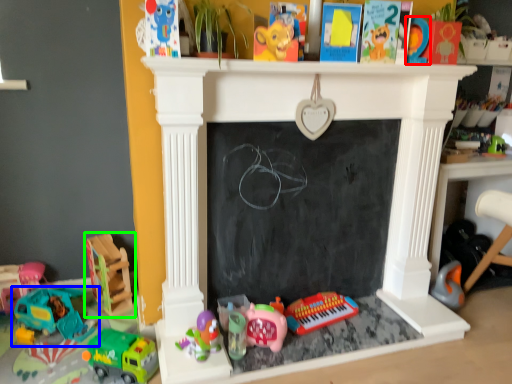
Question: Based on their relative distances, which object is nearer to toy (highlighted by a red box)? Choose from toy (highlighted by a blue box) and toy (highlighted by a green box).

Choices:
 (A) toy
 (B) toy

Answer: (B)